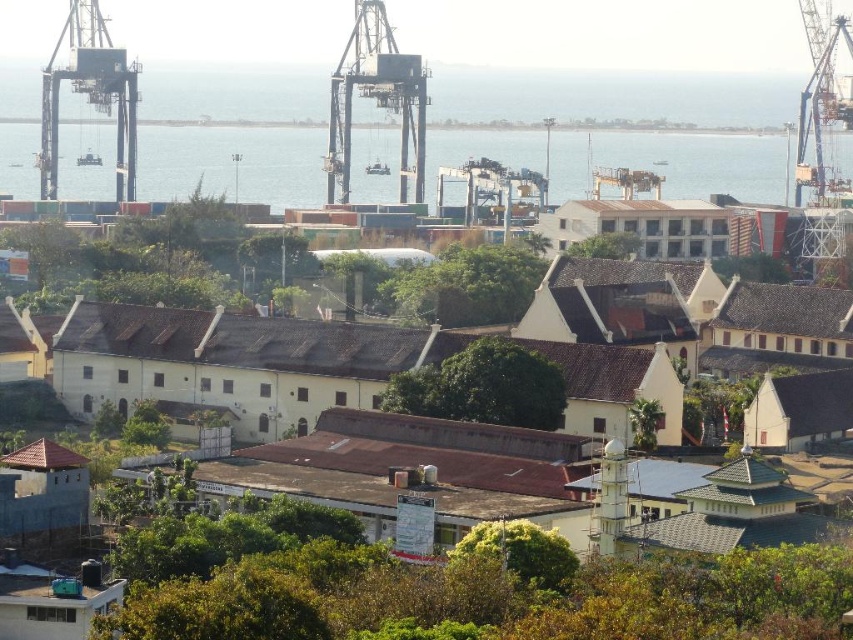
Question: Is blue water at upper center in front of metallic industrial crane at center?

Choices:
 (A) yes
 (B) no

Answer: (B)

Question: Can you confirm if blue water at upper center is bigger than metallic industrial crane at center?

Choices:
 (A) no
 (B) yes

Answer: (B)

Question: Based on their relative distances, which object is farther from the blue water at upper center?

Choices:
 (A) metallic gray crane at upper left
 (B) metallic industrial crane at upper right

Answer: (A)

Question: Considering the relative positions of metallic industrial crane at center and metallic gray crane at upper left in the image provided, where is metallic industrial crane at center located with respect to metallic gray crane at upper left?

Choices:
 (A) right
 (B) left

Answer: (A)

Question: Which point is farther to the camera?

Choices:
 (A) metallic industrial crane at upper right
 (B) white matte building at center

Answer: (A)

Question: Which of the following is the farthest from the observer?

Choices:
 (A) white matte building at center
 (B) blue water at upper center
 (C) metallic gray crane at upper left
 (D) metallic industrial crane at upper right

Answer: (B)